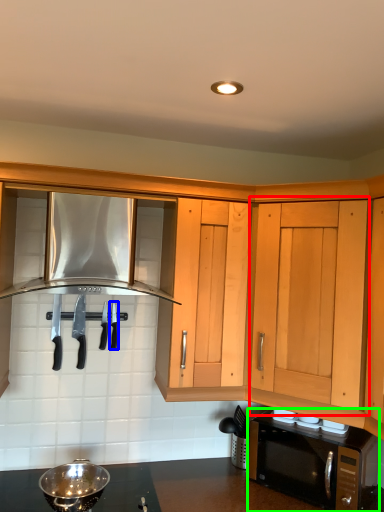
Question: Based on their relative distances, which object is farther from cabinetry (highlighted by a red box)? Choose from silverware (highlighted by a blue box) and microwave oven (highlighted by a green box).

Choices:
 (A) silverware
 (B) microwave oven

Answer: (A)